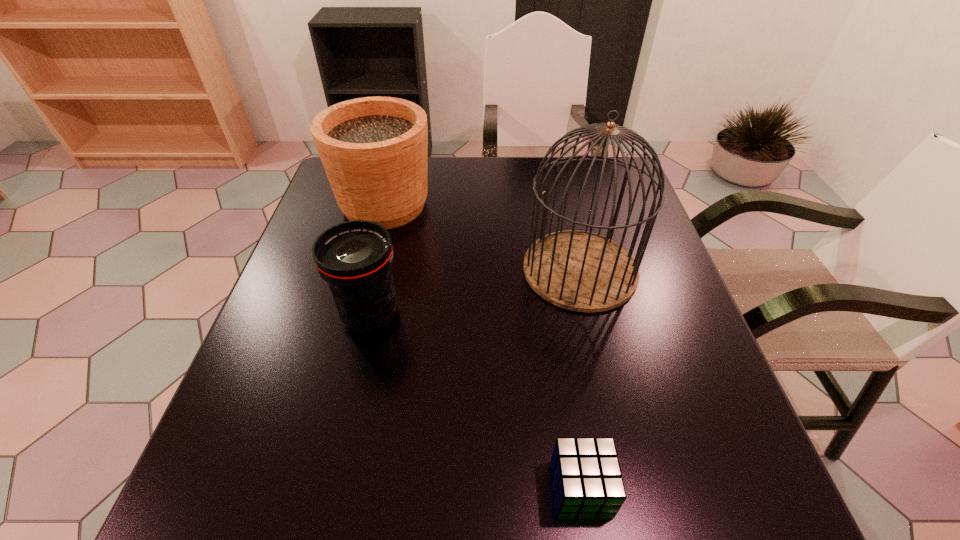
At what (x,y) coordinates should I click in order to perform the action: click on birdcage. Please return your answer as a coordinate pair (x, y). The image size is (960, 540). Looking at the image, I should click on (581, 271).

Where is `flowerpot`? The image size is (960, 540). flowerpot is located at coordinates (374, 150).

Identify the location of telephoto lens. This screenshot has width=960, height=540. (355, 257).

Identify the location of the shortest object. (587, 481).

The image size is (960, 540). I want to click on cube, so click(x=587, y=481).

Image resolution: width=960 pixels, height=540 pixels. I want to click on free space located at the door of the birdcage, so click(420, 269).

Identify the location of free spot located 0.100m at the door of the birdcage. (480, 269).

The height and width of the screenshot is (540, 960). Find the location of `vacant space located at the door of the birdcage`. vacant space located at the door of the birdcage is located at coordinates (446, 269).

Find the location of a particular element. The width and height of the screenshot is (960, 540). free region located on the front of the flowerpot is located at coordinates (367, 275).

This screenshot has width=960, height=540. What are the coordinates of `vacant space located on the back of the telephoto lens` in the screenshot? It's located at (394, 214).